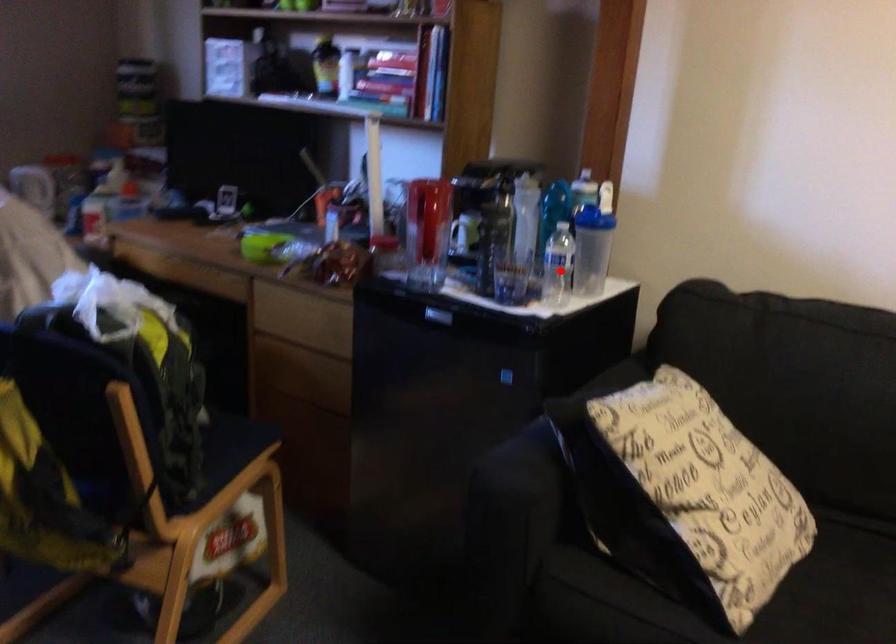
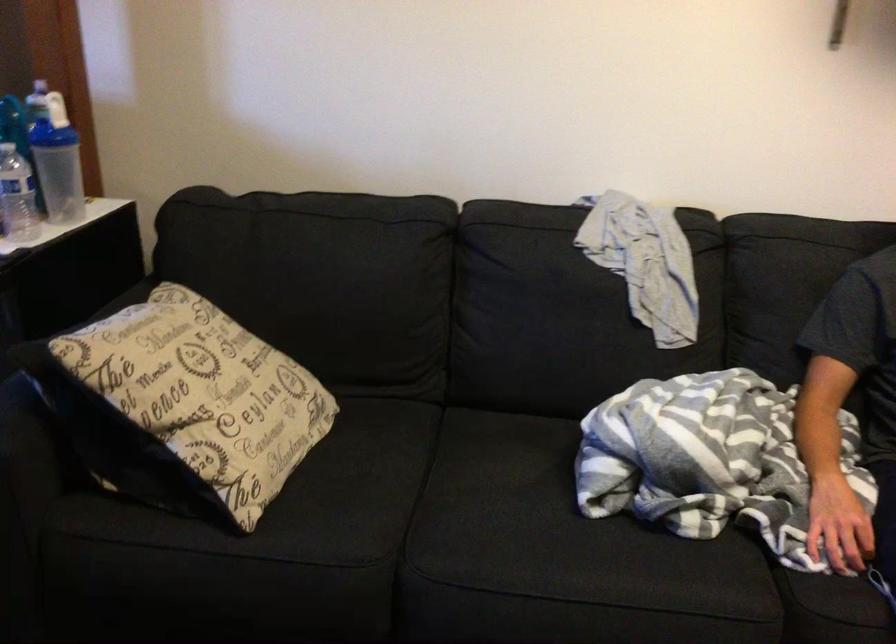
Question: I am providing you with two images of the same scene from different viewpoints. Image1 has a red point marked. In image2, the corresponding 3D location appears at what relative position? Reply with the corresponding letter.

Choices:
 (A) Closer
 (B) Farther

Answer: (A)